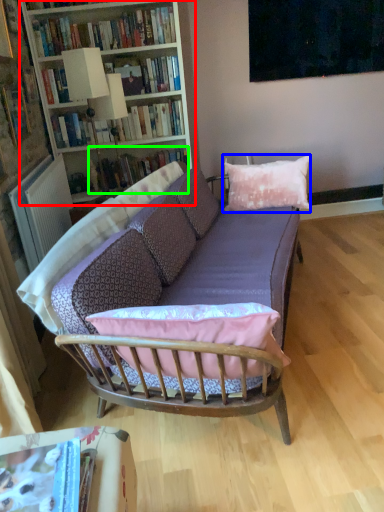
Question: Estimate the real-world distances between objects in this image. Which object is closer to bookcase (highlighted by a red box), pillow (highlighted by a blue box) or book (highlighted by a green box)?

Choices:
 (A) pillow
 (B) book

Answer: (B)